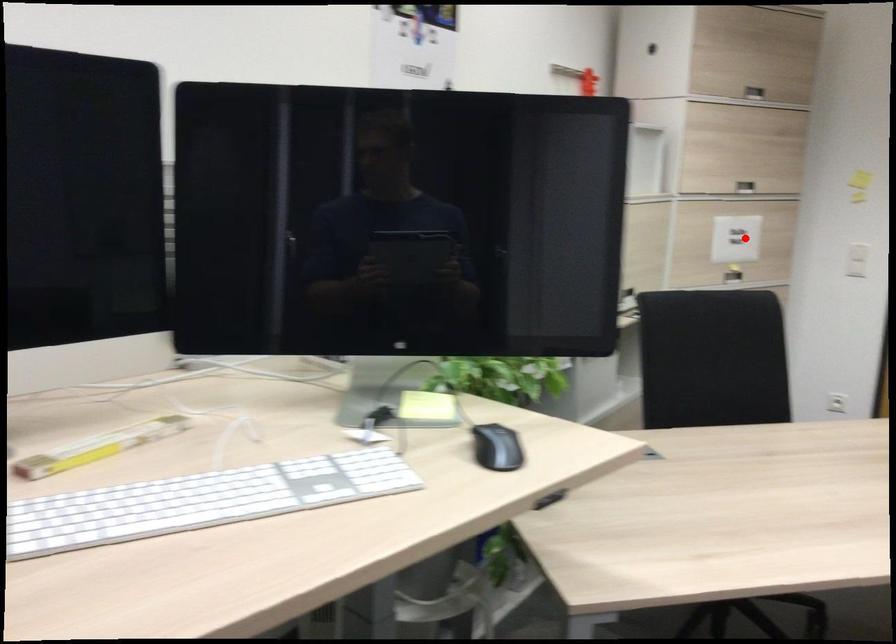
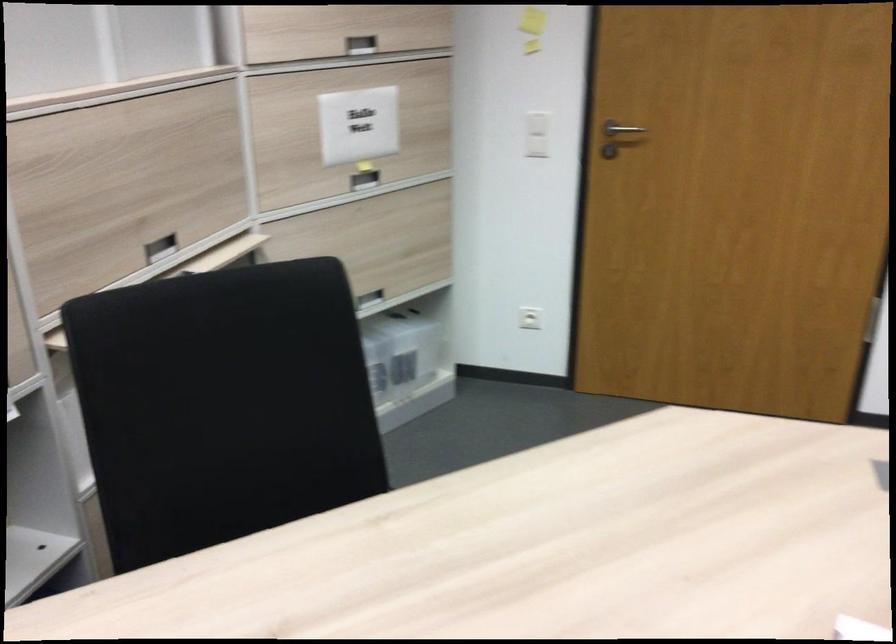
In the second image, find the point that corresponds to the highlighted location in the first image.

(358, 125)